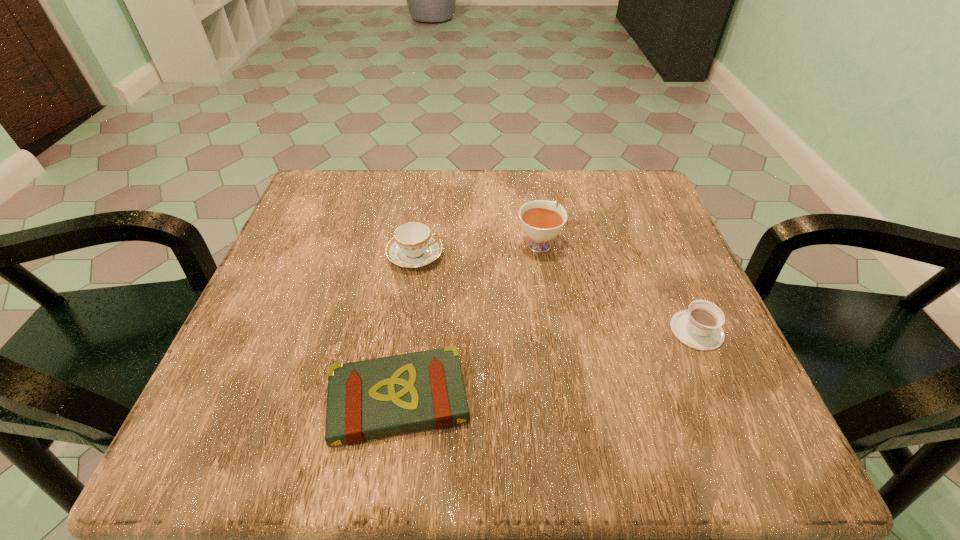
Where is `empty space between the tallest teacup and the second shortest teacup`? empty space between the tallest teacup and the second shortest teacup is located at coordinates (477, 249).

Where is `free area in between the second shortest teacup and the tallest object`? This screenshot has height=540, width=960. free area in between the second shortest teacup and the tallest object is located at coordinates (477, 249).

Where is `empty space that is in between the shortest object and the second shortest object`? The height and width of the screenshot is (540, 960). empty space that is in between the shortest object and the second shortest object is located at coordinates (547, 365).

Locate an element on the screen. Image resolution: width=960 pixels, height=540 pixels. free space between the second teacup from right to left and the nearest object is located at coordinates (468, 321).

Identify the location of free spot between the second object from right to left and the leftmost teacup. The width and height of the screenshot is (960, 540). (477, 249).

Identify the location of object that is the nearest to the third shortest object. The width and height of the screenshot is (960, 540). (541, 221).

Select which object is the third closest to the third tallest object. Please provide its 2D coordinates. Your answer should be formatted as a tuple, i.e. [(x, y)], where the tuple contains the x and y coordinates of a point satisfying the conditions above.

[(413, 245)]

Identify the location of teacup identified as the second closest to the second shortest teacup. (699, 327).

Choose which teacup is the third nearest neighbor to the book. Please provide its 2D coordinates. Your answer should be formatted as a tuple, i.e. [(x, y)], where the tuple contains the x and y coordinates of a point satisfying the conditions above.

[(699, 327)]

Identify the location of free space that satisfies the following two spatial constraints: 1. on the side with the handle of the leftmost teacup; 2. on the handle side of the third farthest object. This screenshot has height=540, width=960. (403, 330).